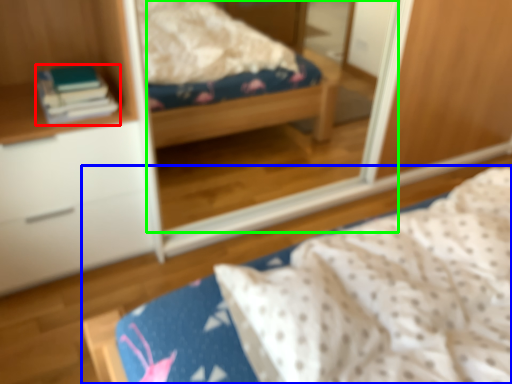
Question: Which object is positioned farthest from book (highlighted by a red box)? Select from bed (highlighted by a blue box) and mirror (highlighted by a green box).

Choices:
 (A) bed
 (B) mirror

Answer: (B)